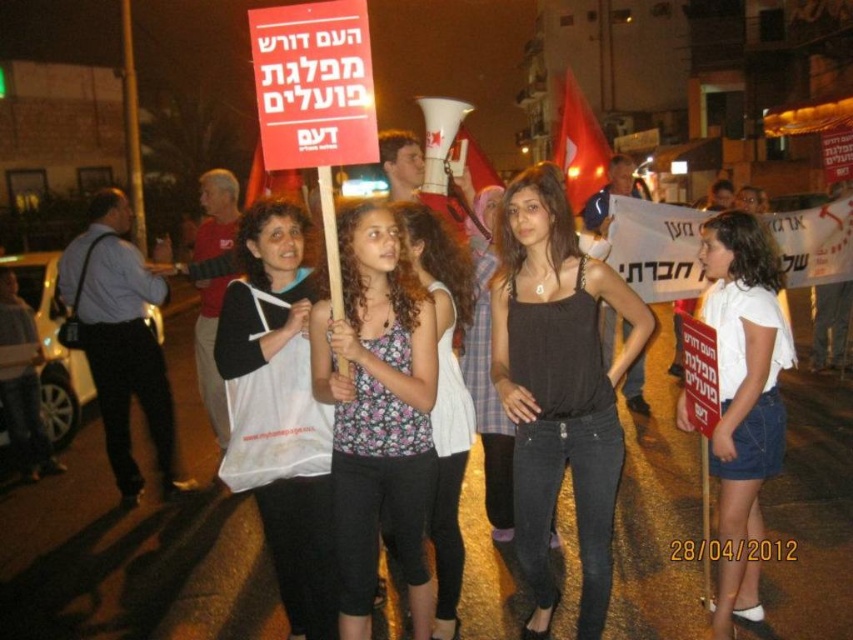
Question: Which point is closer to the camera?

Choices:
 (A) black matte tank top at center
 (B) white plastic bag at center
 (C) white cotton shirt at center
 (D) floral fabric top at center

Answer: (A)

Question: Is floral tank top at center to the right of floral fabric top at center from the viewer's perspective?

Choices:
 (A) no
 (B) yes

Answer: (A)

Question: Estimate the real-world distances between objects in this image. Which object is closer to the floral fabric top at center?

Choices:
 (A) black matte tank top at center
 (B) floral tank top at center
 (C) white cotton shirt at center

Answer: (B)

Question: Is floral tank top at center smaller than white cotton shirt at center?

Choices:
 (A) yes
 (B) no

Answer: (A)

Question: Is black matte tank top at center smaller than floral fabric top at center?

Choices:
 (A) yes
 (B) no

Answer: (B)

Question: Which point is farther to the camera?

Choices:
 (A) (434, 413)
 (B) (741, 440)

Answer: (A)